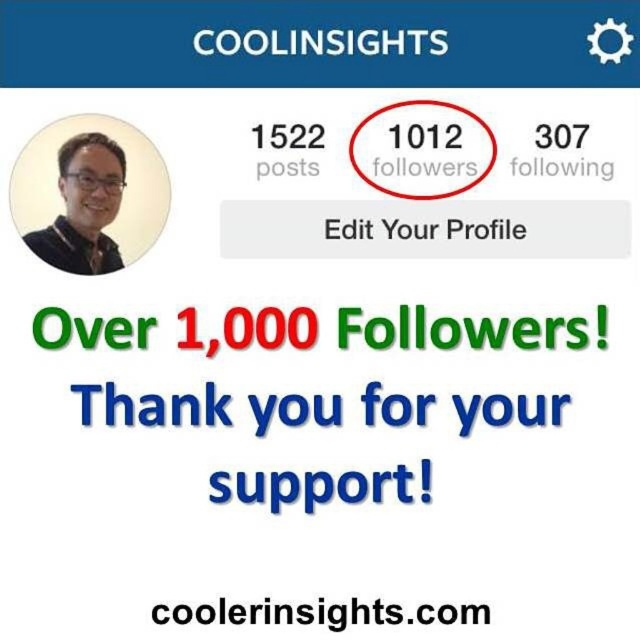
Question: Which object is closer to the camera taking this photo?

Choices:
 (A) matte black glasses at upper left
 (B) black text at center

Answer: (B)

Question: Does matte black glasses at upper left lie behind black text at center?

Choices:
 (A) yes
 (B) no

Answer: (A)

Question: Where is matte black glasses at upper left located in relation to black text at center in the image?

Choices:
 (A) above
 (B) below

Answer: (A)

Question: Which object appears closest to the camera in this image?

Choices:
 (A) matte black glasses at upper left
 (B) black text at center

Answer: (B)

Question: Does matte black glasses at upper left lie behind black text at center?

Choices:
 (A) yes
 (B) no

Answer: (A)